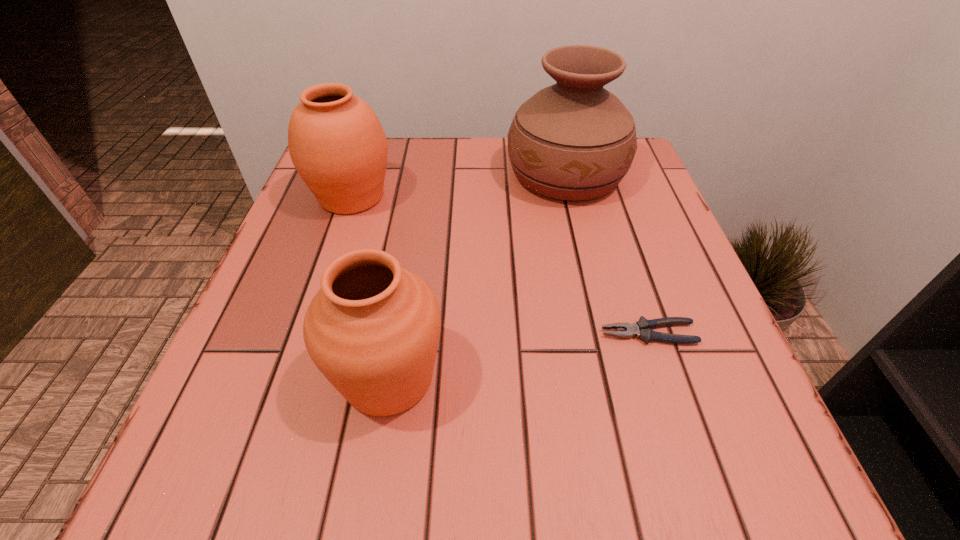
This screenshot has height=540, width=960. I want to click on vacant space that is in between the rightmost urn and the nearest urn, so click(477, 276).

Where is `vacant space that is in between the shortest object and the nearest urn`? Image resolution: width=960 pixels, height=540 pixels. vacant space that is in between the shortest object and the nearest urn is located at coordinates (518, 355).

The height and width of the screenshot is (540, 960). Find the location of `vacant space that is in between the nearest urn and the rightmost urn`. vacant space that is in between the nearest urn and the rightmost urn is located at coordinates (477, 276).

Where is `free space between the rightmost urn and the nearest urn`? The width and height of the screenshot is (960, 540). free space between the rightmost urn and the nearest urn is located at coordinates (477, 276).

Where is `vacant area that lies between the shortest object and the rightmost urn`? The width and height of the screenshot is (960, 540). vacant area that lies between the shortest object and the rightmost urn is located at coordinates (607, 254).

The height and width of the screenshot is (540, 960). In order to click on vacant area that lies between the nearest urn and the pliers in this screenshot , I will do `click(518, 355)`.

Where is `object that can be found as the closest to the rightmost urn`? object that can be found as the closest to the rightmost urn is located at coordinates (337, 144).

Select which object appears as the closest to the shortest object. Please provide its 2D coordinates. Your answer should be formatted as a tuple, i.e. [(x, y)], where the tuple contains the x and y coordinates of a point satisfying the conditions above.

[(373, 328)]

Select which urn appears as the second closest to the rightmost urn. Please provide its 2D coordinates. Your answer should be formatted as a tuple, i.e. [(x, y)], where the tuple contains the x and y coordinates of a point satisfying the conditions above.

[(373, 328)]

The height and width of the screenshot is (540, 960). Identify the location of urn identified as the second closest to the nearest urn. coord(574,140).